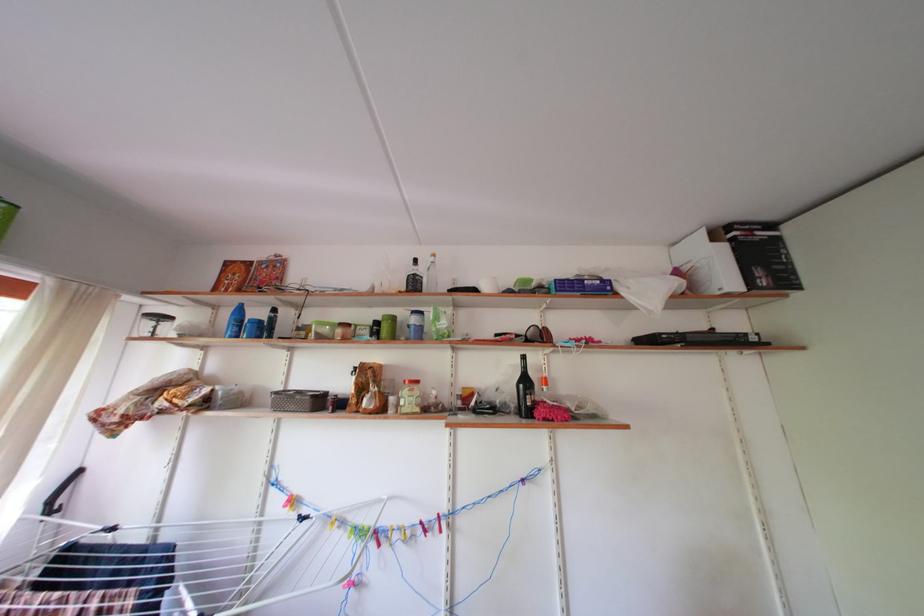
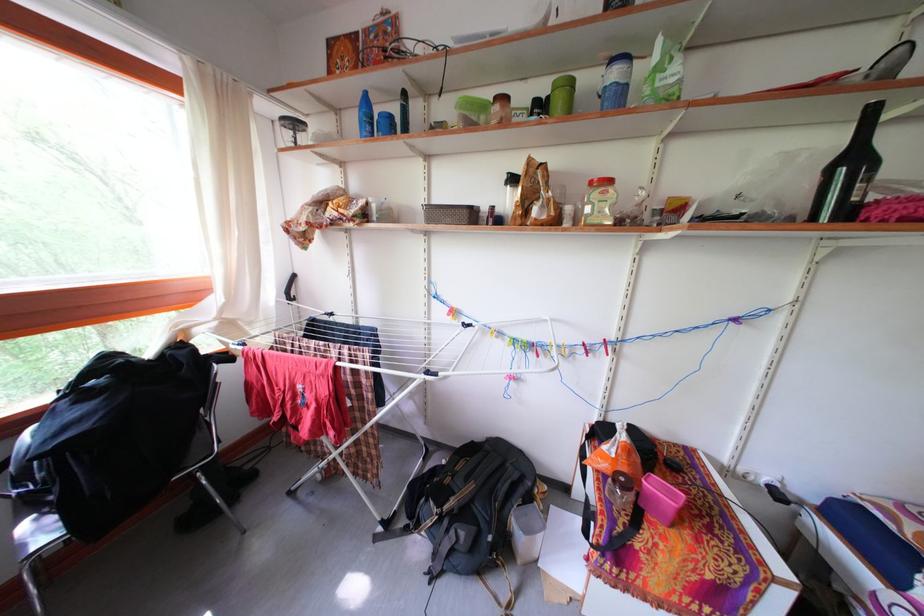
Locate, in the second image, the point that corresponds to point 380,553 in the first image.

(540, 361)